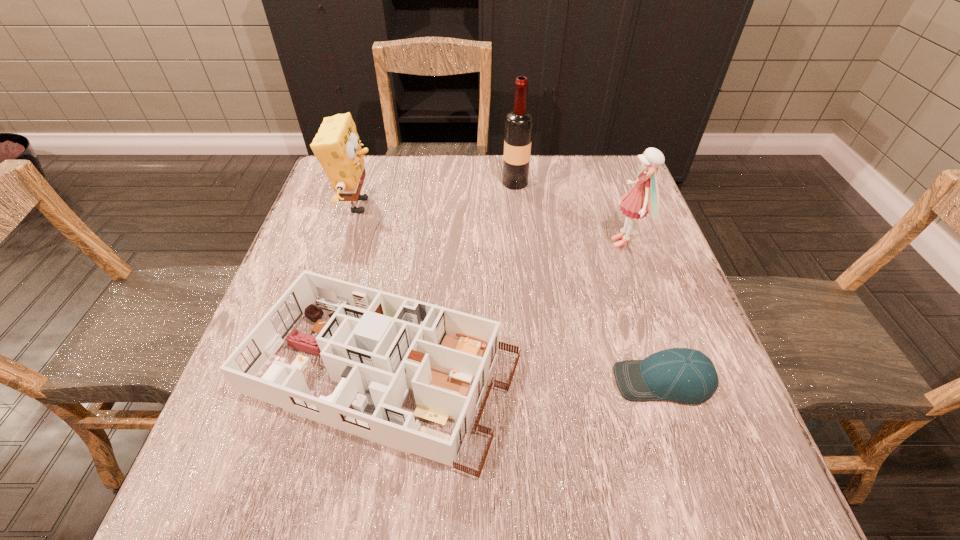
Locate an element on the screen. The image size is (960, 540). wine bottle is located at coordinates (519, 123).

At what (x,y) coordinates should I click in order to perform the action: click on doll. Please return your answer as a coordinate pair (x, y). This screenshot has height=540, width=960. Looking at the image, I should click on (644, 196).

The height and width of the screenshot is (540, 960). I want to click on sponge, so click(336, 146).

Locate an element on the screen. The height and width of the screenshot is (540, 960). dollhouse is located at coordinates (377, 345).

In order to click on the shortest object in this screenshot , I will do `click(684, 375)`.

Where is `vacant space located 0.160m on the left of the wine bottle`? The image size is (960, 540). vacant space located 0.160m on the left of the wine bottle is located at coordinates (445, 183).

The width and height of the screenshot is (960, 540). Find the location of `vacant region located on the front-facing side of the doll`. vacant region located on the front-facing side of the doll is located at coordinates (584, 242).

The height and width of the screenshot is (540, 960). What are the coordinates of `vacant point located on the front-facing side of the doll` in the screenshot? It's located at (530, 242).

Where is `vacant area situated on the front-facing side of the doll`? This screenshot has height=540, width=960. vacant area situated on the front-facing side of the doll is located at coordinates (571, 242).

This screenshot has height=540, width=960. I want to click on vacant space located on the face of the sponge, so click(x=482, y=205).